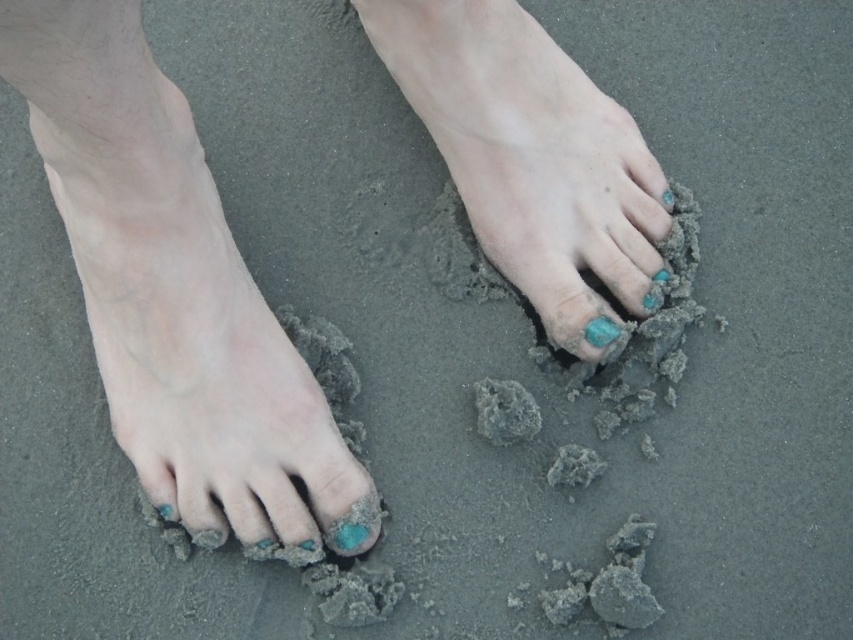
You are a photographer trying to capture the details of the teal polished nails at center and the matte turquoise stone at center. Since the lighting is natural and the perspective is from above, which object would you focus on first if you want to ensure both are in the frame but prioritize the larger one?

The teal polished nails at center should be focused on first because they are larger in size compared to the matte turquoise stone at center, ensuring they are properly framed before adjusting for the smaller stone.

You are a photographer taking a picture of two feet on the sand. You want to place a small seashell exactly between the two feet. Given the coordinates of the matte skin foot at left, where should you place the seashell?

The seashell should be placed at the midpoint between the matte skin foot at left and the other foot. Since the coordinates of the matte skin foot at left are at point (184,323), the seashell should be placed at the midpoint between these coordinates and the position of the other foot. However, the exact coordinates of the other foot are not provided, so the midpoint cannot be calculated precisely without additional information.

Looking at this image, you are a photographer trying to capture the details of the teal polished nails at center and the matte turquoise stone at center. Since you want to focus on the nails, which object should you adjust your camera to prioritize in the foreground?

The teal polished nails at center are closer to the viewer than the matte turquoise stone at center, so you should prioritize focusing on the teal polished nails at center to ensure they are in the foreground.